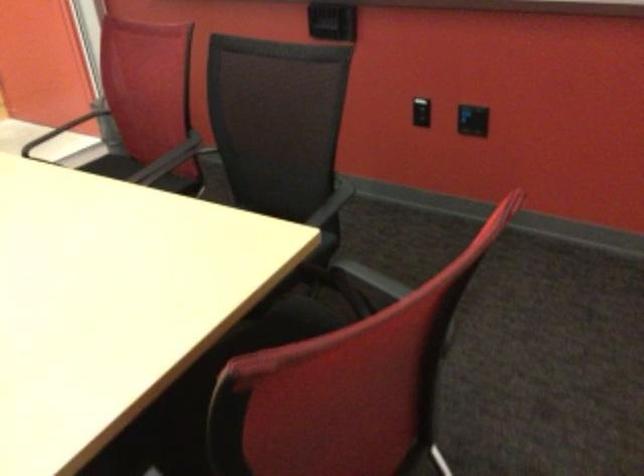
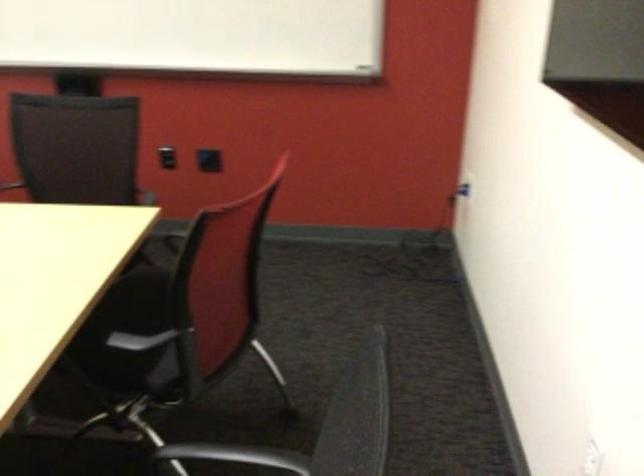
Locate, in the second image, the point that corresponds to (412,110) in the first image.

(167, 157)